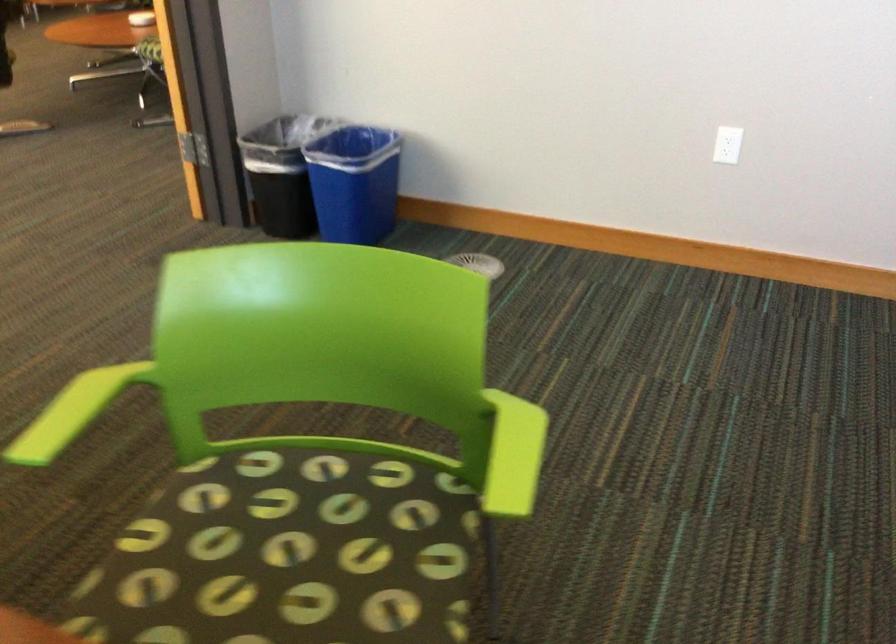
This screenshot has height=644, width=896. Describe the element at coordinates (297, 545) in the screenshot. I see `a chair sitting surface` at that location.